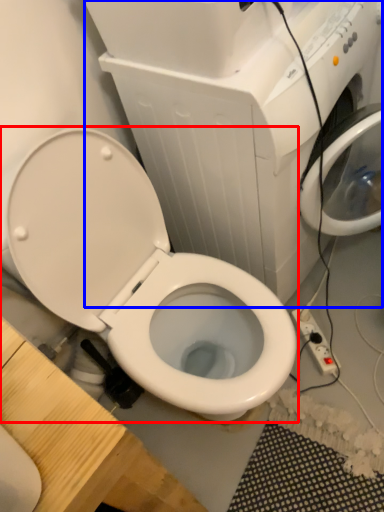
Question: Which of the following is the farthest to the observer, toilet (highlighted by a red box) or appliance (highlighted by a blue box)?

Choices:
 (A) toilet
 (B) appliance

Answer: (B)